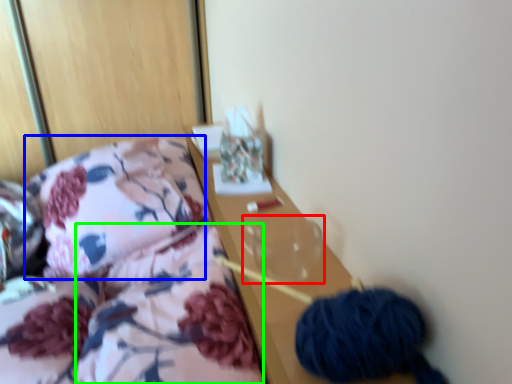
Question: Which is nearer to the glass vase (highlighted by a red box)? throw pillow (highlighted by a blue box) or quilt (highlighted by a green box).

Choices:
 (A) throw pillow
 (B) quilt

Answer: (B)